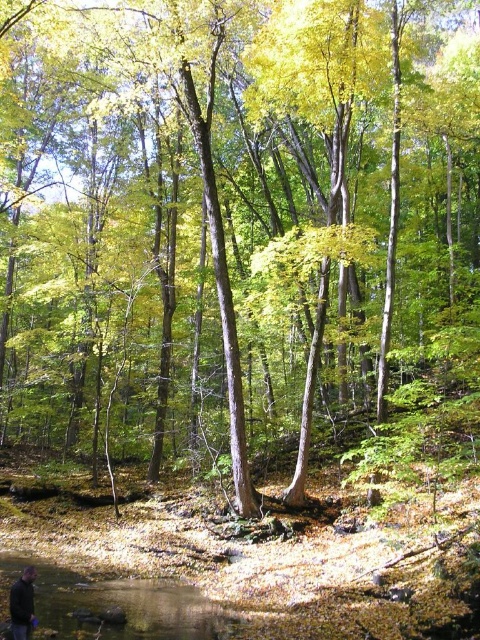
Question: Can you confirm if clear water at lower left is smaller than dark gray jacket at lower left?

Choices:
 (A) no
 (B) yes

Answer: (B)

Question: Is clear water at lower left below dark gray jacket at lower left?

Choices:
 (A) no
 (B) yes

Answer: (B)

Question: Which point is farther to the camera?

Choices:
 (A) (227, 611)
 (B) (28, 604)

Answer: (A)

Question: Which object appears closest to the camera in this image?

Choices:
 (A) dark gray jacket at lower left
 (B) clear water at lower left

Answer: (A)

Question: Does clear water at lower left appear on the left side of dark gray jacket at lower left?

Choices:
 (A) no
 (B) yes

Answer: (A)